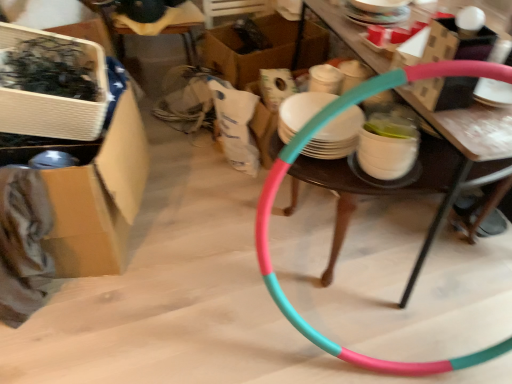
Question: In terms of height, does pink rubber hula hoop at center look taller or shorter compared to wooden chair at upper center?

Choices:
 (A) tall
 (B) short

Answer: (B)

Question: From the image's perspective, is pink rubber hula hoop at center located above or below wooden chair at upper center?

Choices:
 (A) above
 (B) below

Answer: (B)

Question: Which object is the closest to the cardboard box at left, which is the 2th box in front-to-back order?

Choices:
 (A) teal plastic hoop at center
 (B) wooden chair at upper center
 (C) white cardboard box at upper left, which is the third box in back-to-front order
 (D) cardboard box at center, the third box viewed from the front
 (E) pink rubber hula hoop at center

Answer: (C)

Question: Considering the real-world distances, which object is closest to the wooden chair at upper center?

Choices:
 (A) pink rubber hula hoop at center
 (B) white cardboard box at upper left, marked as the 1th box in a front-to-back arrangement
 (C) cardboard box at center, the third box viewed from the front
 (D) cardboard box at left, which is counted as the second box, starting from the back
 (E) teal plastic hoop at center

Answer: (C)